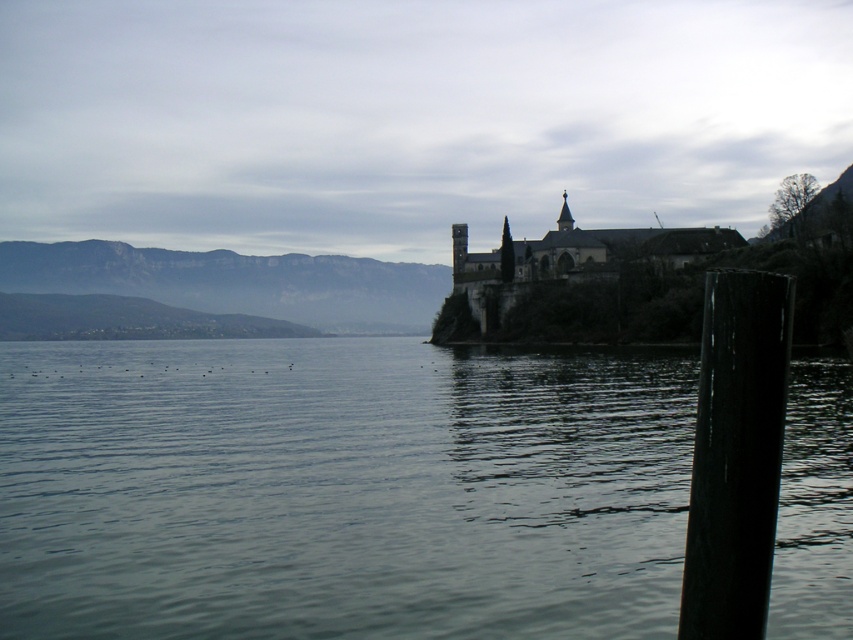
Question: Estimate the real-world distances between objects in this image. Which object is farther from the smooth dark water at center?

Choices:
 (A) black smooth pole at right
 (B) dark stone castle at center

Answer: (A)

Question: Estimate the real-world distances between objects in this image. Which object is farther from the black smooth pole at right?

Choices:
 (A) smooth dark water at center
 (B) dark stone castle at center

Answer: (B)

Question: Does smooth dark water at center appear over black smooth pole at right?

Choices:
 (A) yes
 (B) no

Answer: (B)

Question: Which object appears farthest from the camera in this image?

Choices:
 (A) black smooth pole at right
 (B) dark stone castle at center
 (C) smooth dark water at center

Answer: (B)

Question: Can you confirm if black smooth pole at right is positioned above dark stone castle at center?

Choices:
 (A) yes
 (B) no

Answer: (B)

Question: Is smooth dark water at center below dark stone castle at center?

Choices:
 (A) no
 (B) yes

Answer: (B)